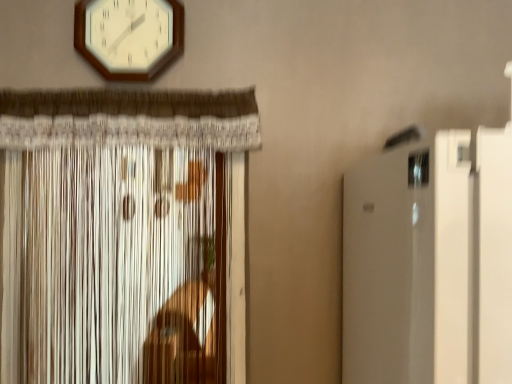
Question: Considering their positions, is white wooden wall clock at upper center located in front of or behind white textured curtain at left?

Choices:
 (A) front
 (B) behind

Answer: (B)

Question: Is point (81, 11) closer or farther from the camera than point (162, 251)?

Choices:
 (A) closer
 (B) farther

Answer: (A)

Question: From the image's perspective, is white wooden wall clock at upper center positioned above or below white textured curtain at left?

Choices:
 (A) above
 (B) below

Answer: (A)

Question: In terms of width, does white textured curtain at left look wider or thinner when compared to white wooden wall clock at upper center?

Choices:
 (A) thin
 (B) wide

Answer: (B)

Question: Considering the positions of point (167, 254) and point (174, 21), is point (167, 254) closer or farther from the camera than point (174, 21)?

Choices:
 (A) farther
 (B) closer

Answer: (A)

Question: From their relative heights in the image, would you say white textured curtain at left is taller or shorter than white wooden wall clock at upper center?

Choices:
 (A) short
 (B) tall

Answer: (B)

Question: From a real-world perspective, is white textured curtain at left physically located above or below white wooden wall clock at upper center?

Choices:
 (A) below
 (B) above

Answer: (A)